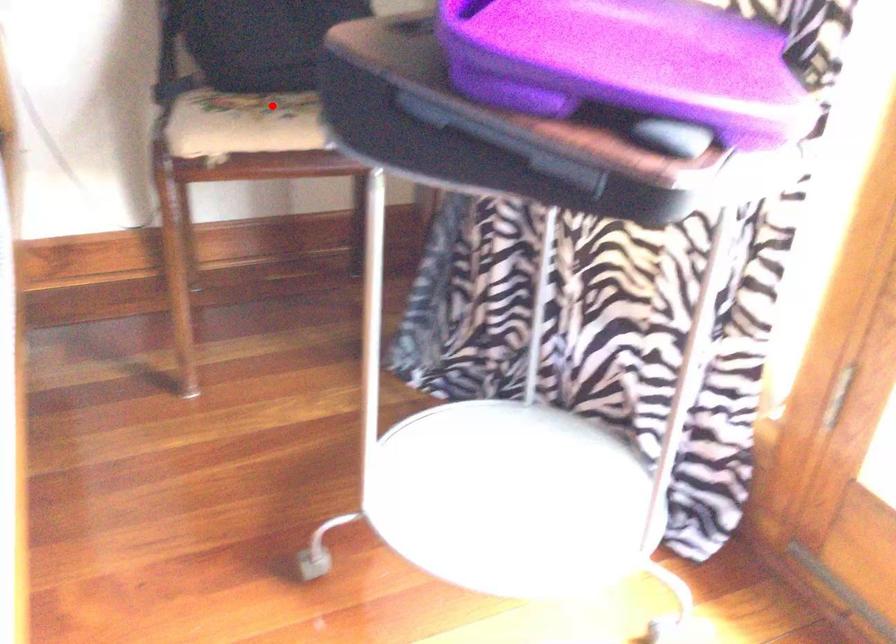
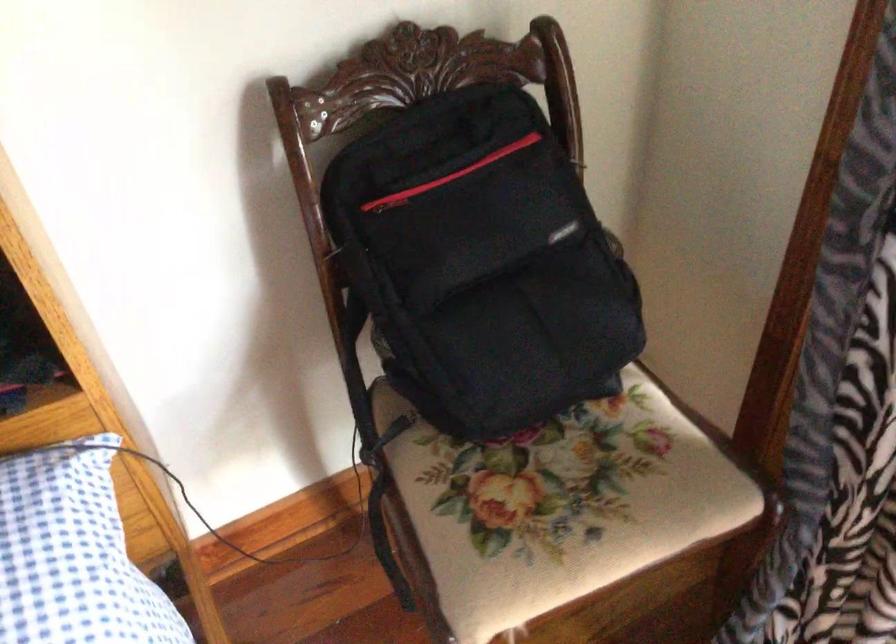
Question: A red point is marked in image1. In image2, is the corresponding 3D point closer to the camera or farther? Reply with the corresponding letter.

Choices:
 (A) The corresponding 3D point is closer.
 (B) The corresponding 3D point is farther.

Answer: (A)